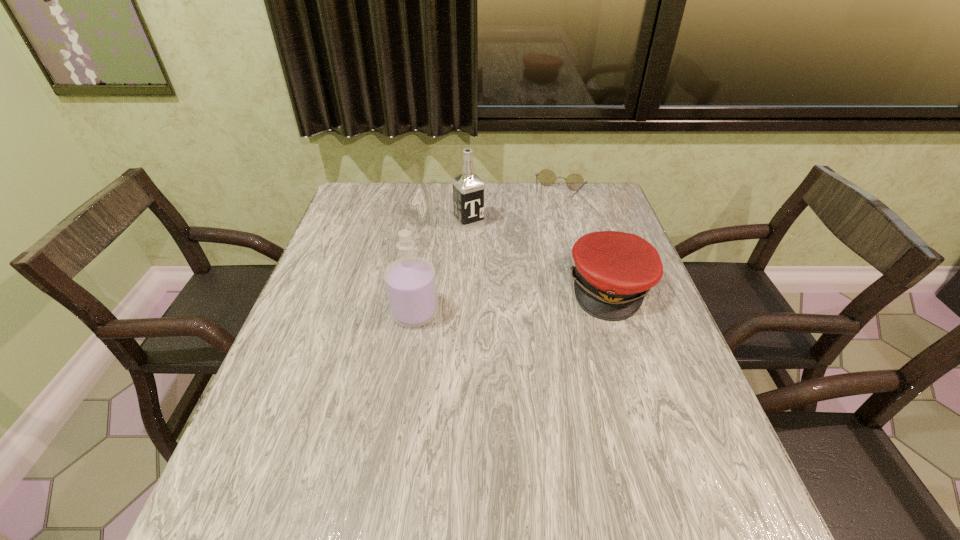
The height and width of the screenshot is (540, 960). What are the coordinates of `vacant space located on the front label of the second object from left to right` in the screenshot? It's located at (489, 245).

At what (x,y) coordinates should I click in order to perform the action: click on blank space located on the front-facing side of the farthest object. Please return your answer as a coordinate pair (x, y). The height and width of the screenshot is (540, 960). Looking at the image, I should click on (525, 281).

Find the location of a particular element. Image resolution: width=960 pixels, height=540 pixels. vacant space located 0.220m on the front-facing side of the farthest object is located at coordinates pyautogui.click(x=539, y=247).

Locate an element on the screen. free point located 0.110m on the front-facing side of the farthest object is located at coordinates (547, 226).

Where is `vodka that is at the far edge`? Image resolution: width=960 pixels, height=540 pixels. vodka that is at the far edge is located at coordinates 468,189.

At what (x,y) coordinates should I click in order to perform the action: click on spectacles that is at the far edge. Please return your answer as a coordinate pair (x, y). Image resolution: width=960 pixels, height=540 pixels. Looking at the image, I should click on (575, 182).

You are a GUI agent. You are given a task and a screenshot of the screen. Output one action in this format:
    pyautogui.click(x=<x>, y=<y>)
    Task: Click on the cap that is at the right edge
    Image resolution: width=960 pixels, height=540 pixels.
    Given the screenshot: What is the action you would take?
    pyautogui.click(x=614, y=271)

Locate an element on the screen. spectacles present at the right edge is located at coordinates (575, 182).

Image resolution: width=960 pixels, height=540 pixels. I want to click on object located at the far right corner, so click(x=575, y=182).

This screenshot has width=960, height=540. In order to click on vacant space at the far edge in this screenshot , I will do `click(499, 213)`.